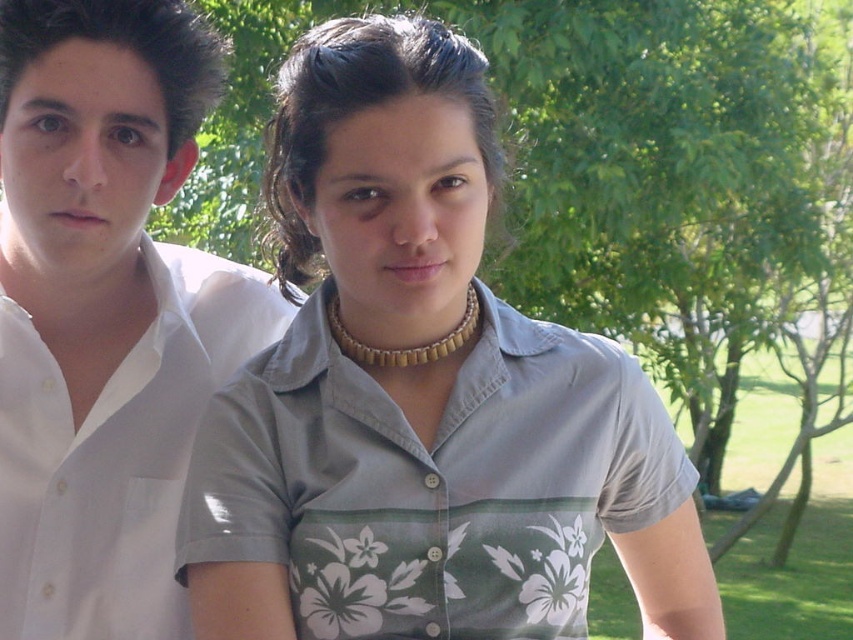
Question: Is gray fabric shirt at center below white cotton shirt at left?

Choices:
 (A) no
 (B) yes

Answer: (B)

Question: Which point is closer to the camera taking this photo?

Choices:
 (A) (138, 433)
 (B) (178, 572)

Answer: (B)

Question: Where is gray fabric shirt at center located in relation to white cotton shirt at left in the image?

Choices:
 (A) below
 (B) above

Answer: (A)

Question: Which of the following is the closest to the observer?

Choices:
 (A) white cotton shirt at left
 (B) gray fabric shirt at center

Answer: (B)

Question: Does gray fabric shirt at center have a smaller size compared to white cotton shirt at left?

Choices:
 (A) yes
 (B) no

Answer: (B)